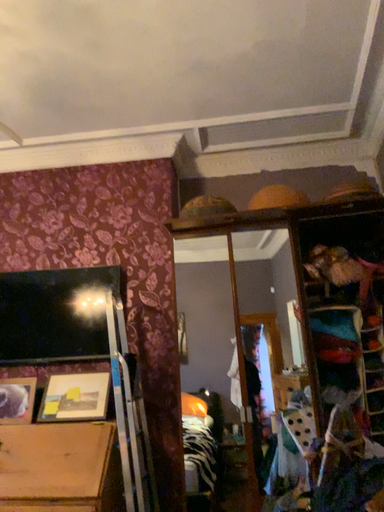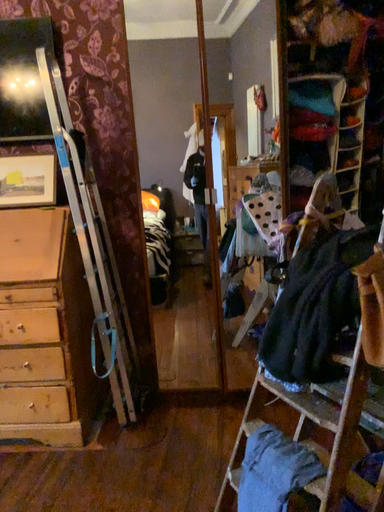
Question: Which way did the camera rotate in the video?

Choices:
 (A) rotated upward
 (B) rotated downward

Answer: (B)